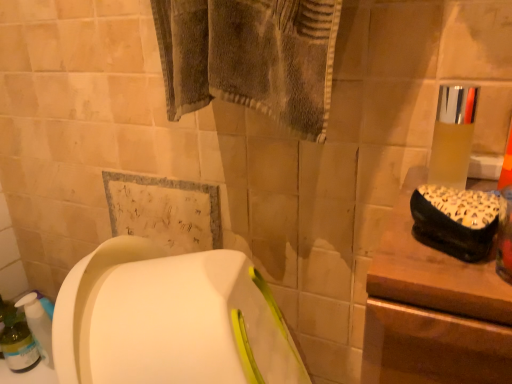
Question: Should I look upward or downward to see translucent plastic cup at upper right?

Choices:
 (A) down
 (B) up

Answer: (B)

Question: Is translucent plastic bottle at lower left taller than translucent plastic cup at upper right?

Choices:
 (A) yes
 (B) no

Answer: (A)

Question: Is translucent plastic bottle at lower left smaller than translucent plastic cup at upper right?

Choices:
 (A) no
 (B) yes

Answer: (A)

Question: Is translucent plastic bottle at lower left positioned with its back to translucent plastic cup at upper right?

Choices:
 (A) no
 (B) yes

Answer: (A)

Question: Is translucent plastic bottle at lower left behind translucent plastic cup at upper right?

Choices:
 (A) no
 (B) yes

Answer: (B)

Question: Is translucent plastic bottle at lower left wider than translucent plastic cup at upper right?

Choices:
 (A) no
 (B) yes

Answer: (B)

Question: Are translucent plastic bottle at lower left and translucent plastic cup at upper right far apart?

Choices:
 (A) yes
 (B) no

Answer: (A)

Question: Can you confirm if translucent plastic cup at upper right is thinner than translucent plastic bottle at lower left?

Choices:
 (A) yes
 (B) no

Answer: (A)

Question: Considering the relative sizes of translucent plastic cup at upper right and translucent plastic bottle at lower left in the image provided, is translucent plastic cup at upper right bigger than translucent plastic bottle at lower left?

Choices:
 (A) no
 (B) yes

Answer: (A)

Question: From the image's perspective, does translucent plastic cup at upper right appear lower than translucent plastic bottle at lower left?

Choices:
 (A) yes
 (B) no

Answer: (B)

Question: Can you confirm if translucent plastic cup at upper right is positioned to the right of translucent plastic bottle at lower left?

Choices:
 (A) yes
 (B) no

Answer: (A)

Question: Considering the relative positions of translucent plastic cup at upper right and translucent plastic bottle at lower left in the image provided, is translucent plastic cup at upper right behind translucent plastic bottle at lower left?

Choices:
 (A) yes
 (B) no

Answer: (B)

Question: Is translucent plastic cup at upper right not inside translucent plastic bottle at lower left?

Choices:
 (A) no
 (B) yes

Answer: (B)

Question: Is translucent plastic bottle at lower left wider or thinner than translucent plastic cup at upper right?

Choices:
 (A) thin
 (B) wide

Answer: (B)